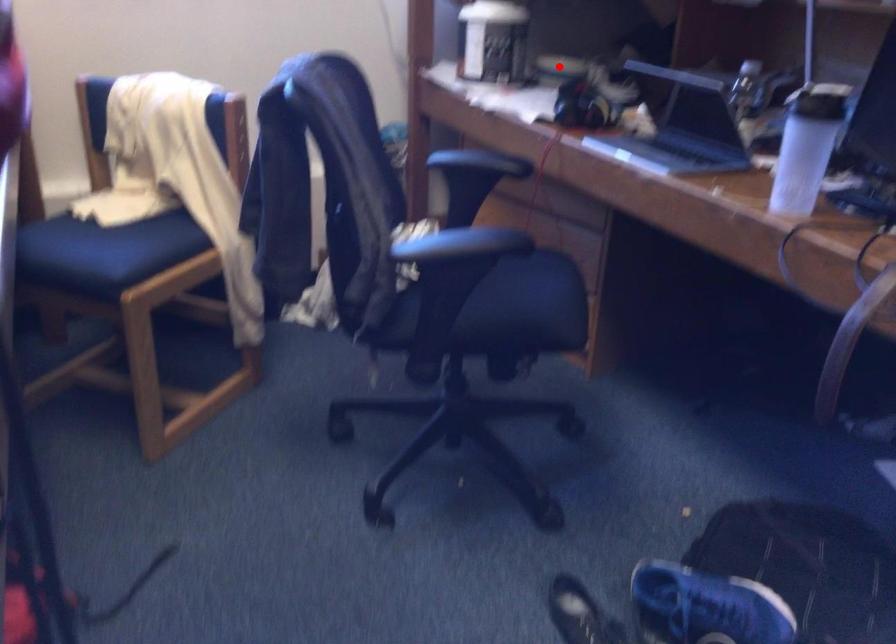
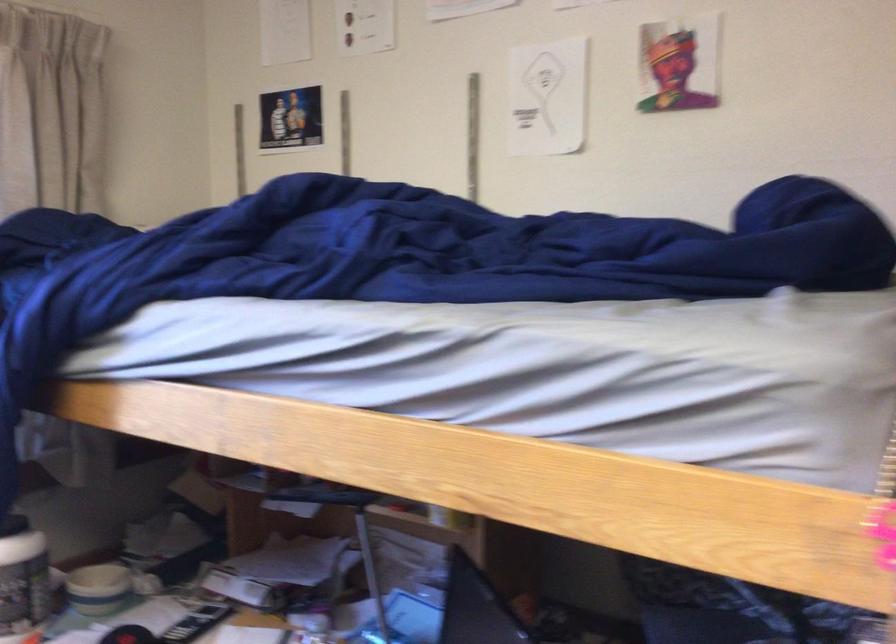
Locate, in the second image, the point that corresponds to the highlighted location in the first image.

(98, 589)